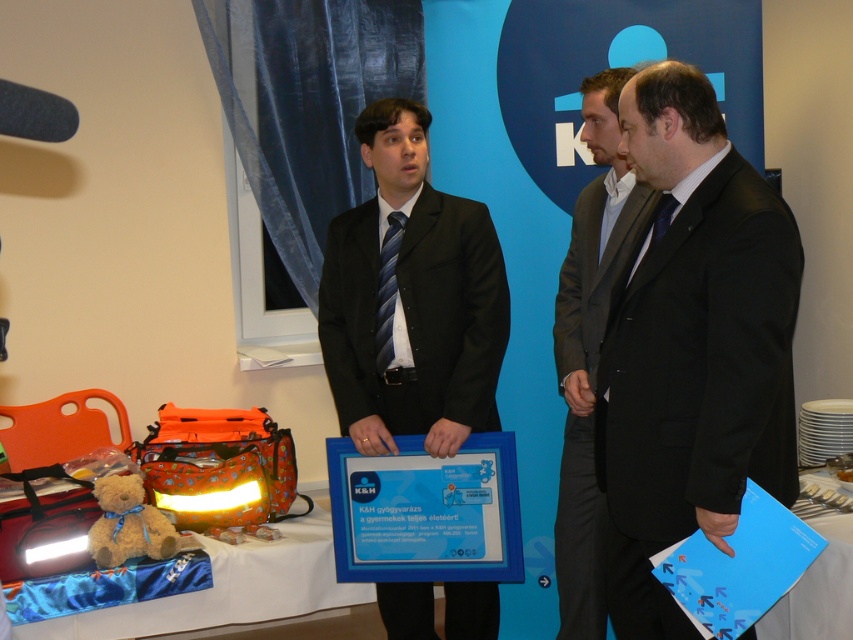
Question: Which of these objects is positioned farthest from the white satin table at lower left?

Choices:
 (A) black suit at center
 (B) black matte suit at center

Answer: (B)

Question: Which object appears closest to the camera in this image?

Choices:
 (A) matte black suit at center
 (B) white glossy table at lower right
 (C) soft brown teddy bear at lower left
 (D) white satin table at lower left

Answer: (B)

Question: Can you confirm if matte black suit at center is wider than white satin table at lower left?

Choices:
 (A) no
 (B) yes

Answer: (A)

Question: From the image, what is the correct spatial relationship of black matte suit at center in relation to white satin table at lower left?

Choices:
 (A) right
 (B) left

Answer: (A)

Question: Which of these objects is positioned farthest from the matte black suit at center?

Choices:
 (A) soft brown teddy bear at lower left
 (B) black suit at center

Answer: (A)

Question: Can you confirm if white satin table at lower left is thinner than white glossy table at lower right?

Choices:
 (A) no
 (B) yes

Answer: (A)